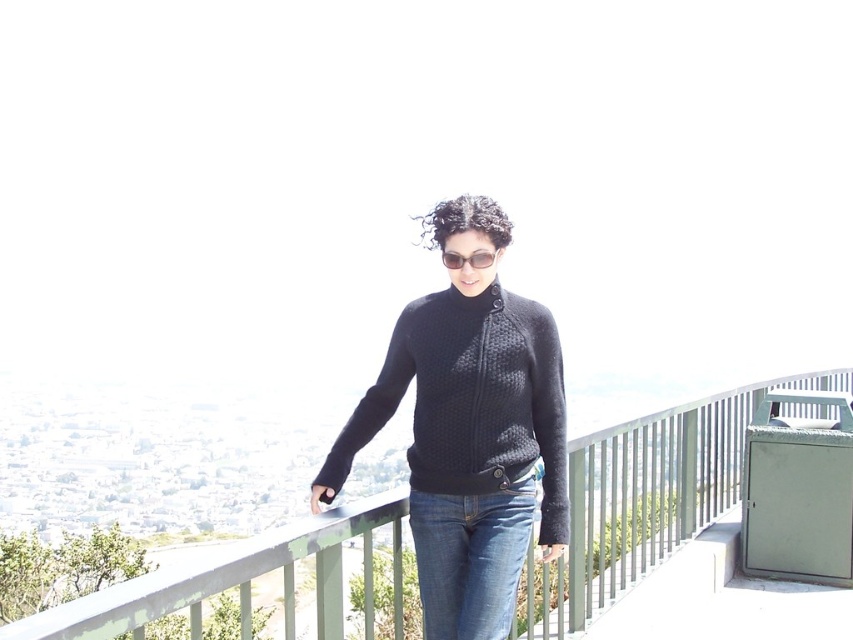
Between green metal railing at center and denim jeans at center, which one appears on the left side from the viewer's perspective?

denim jeans at center is more to the left.

Image resolution: width=853 pixels, height=640 pixels. What are the coordinates of `green metal railing at center` in the screenshot? It's located at (646, 497).

Is matte black sweater at center shorter than black plastic sunglasses at center?

Incorrect, matte black sweater at center's height does not fall short of black plastic sunglasses at center's.

Can you confirm if matte black sweater at center is positioned to the left of black plastic sunglasses at center?

Yes, matte black sweater at center is to the left of black plastic sunglasses at center.

The width and height of the screenshot is (853, 640). I want to click on matte black sweater at center, so click(x=469, y=429).

What are the coordinates of `matte black sweater at center` in the screenshot? It's located at (469, 429).

Does point (515, 486) come behind point (509, 605)?

Yes, point (515, 486) is behind point (509, 605).

Between matte black sweater at center and denim jeans at center, which one is positioned lower?

denim jeans at center is lower down.

The height and width of the screenshot is (640, 853). What are the coordinates of `matte black sweater at center` in the screenshot? It's located at (469, 429).